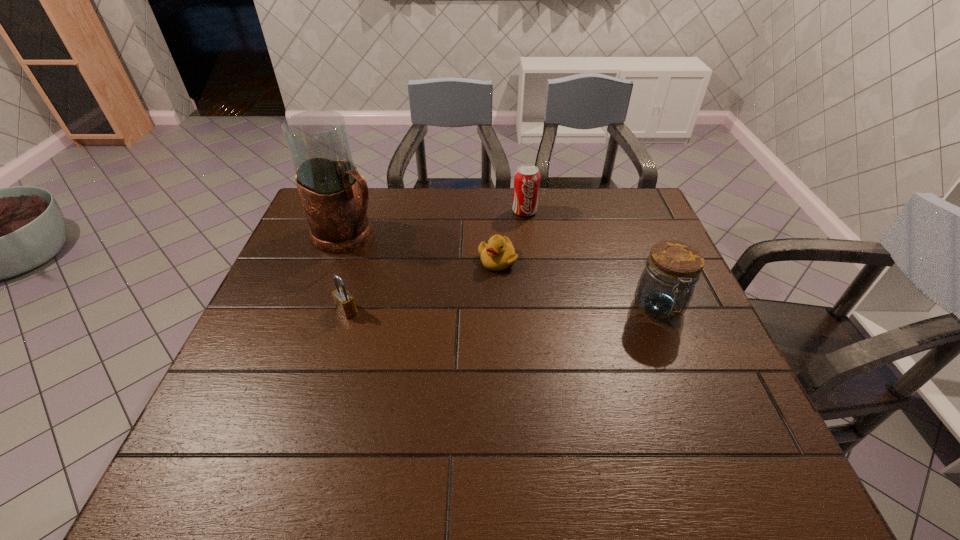
Locate an element on the screen. vacant space situated 0.370m on the logo side of the fourth object from left to right is located at coordinates (541, 301).

Identify the location of free location located 0.310m on the logo side of the fourth object from left to right. Image resolution: width=960 pixels, height=540 pixels. (539, 285).

Where is `vacant space situated with the handle on the side of the tallest object`? The image size is (960, 540). vacant space situated with the handle on the side of the tallest object is located at coordinates (391, 256).

Locate an element on the screen. The width and height of the screenshot is (960, 540). free location located 0.070m with the handle on the side of the tallest object is located at coordinates (391, 256).

This screenshot has width=960, height=540. I want to click on free space located 0.060m with the handle on the side of the tallest object, so coord(388,255).

Locate an element on the screen. The width and height of the screenshot is (960, 540). free region located on the front-facing side of the shortest object is located at coordinates (480, 294).

Where is `vacant space located on the front-facing side of the shortest object`? vacant space located on the front-facing side of the shortest object is located at coordinates (468, 314).

At what (x,y) coordinates should I click in order to perform the action: click on blank area located 0.250m on the front-facing side of the shortest object. Please return your answer as a coordinate pair (x, y). The width and height of the screenshot is (960, 540). Looking at the image, I should click on (457, 338).

The height and width of the screenshot is (540, 960). What are the coordinates of `soda can that is at the far edge` in the screenshot? It's located at coord(527,177).

This screenshot has height=540, width=960. I want to click on pitcher located at the far edge, so click(335, 197).